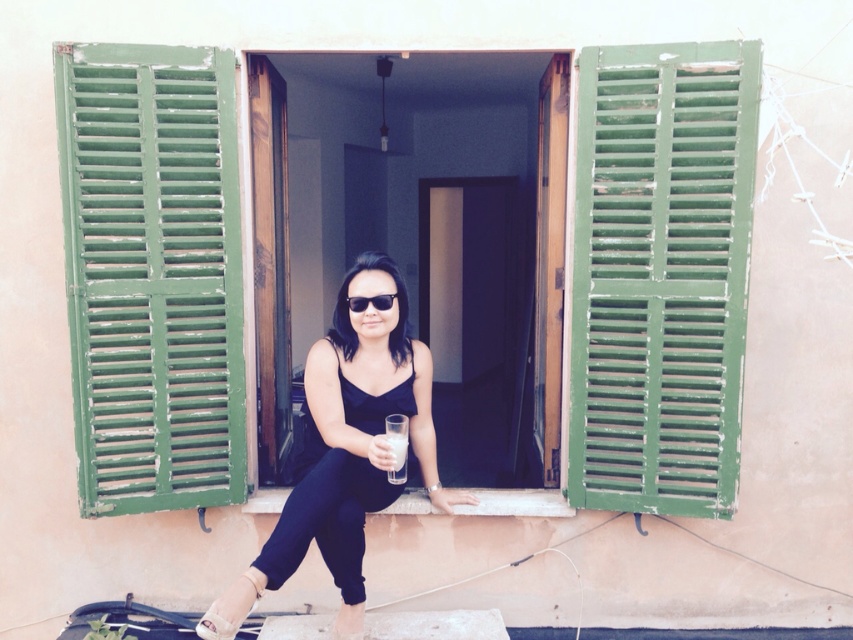
Is point (526, 138) closer to camera compared to point (354, 305)?

That is False.

Between point (558, 65) and point (386, 304), which one is positioned behind?

Positioned behind is point (558, 65).

I want to click on green wooden window at center, so click(442, 230).

Between green painted wood shutters at left and white leather sandal at lower left, which one has less height?

With less height is white leather sandal at lower left.

Is green painted wood shutters at left closer to the viewer compared to white leather sandal at lower left?

That is False.

Does point (158, 52) come farther from viewer compared to point (212, 625)?

Yes, point (158, 52) is behind point (212, 625).

You are a GUI agent. You are given a task and a screenshot of the screen. Output one action in this format:
    pyautogui.click(x=<x>, y=<y>)
    Task: Click on the green painted wood shutters at left
    
    Given the screenshot: What is the action you would take?
    pyautogui.click(x=152, y=275)

Which is above, matte black dress at center or black plastic sunglasses at center?

black plastic sunglasses at center is above.

Which of these two, matte black dress at center or black plastic sunglasses at center, stands taller?

matte black dress at center is taller.

What do you see at coordinates (355, 436) in the screenshot? I see `matte black dress at center` at bounding box center [355, 436].

You are a GUI agent. You are given a task and a screenshot of the screen. Output one action in this format:
    pyautogui.click(x=<x>, y=<y>)
    Task: Click on the matte black dress at center
    The height and width of the screenshot is (640, 853).
    Given the screenshot: What is the action you would take?
    pyautogui.click(x=355, y=436)